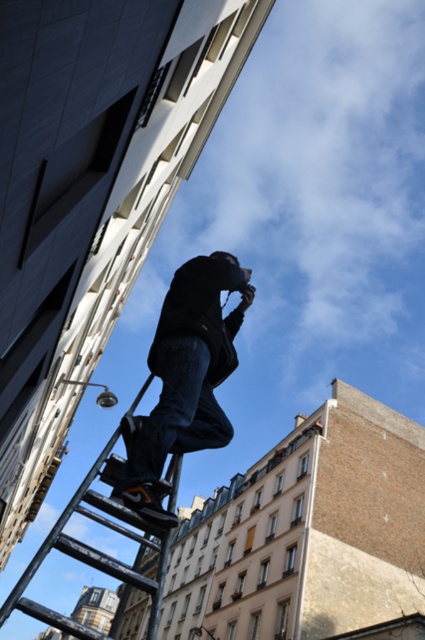
Question: Does denim jeans at center appear on the left side of metallic black ladder at lower center?

Choices:
 (A) yes
 (B) no

Answer: (B)

Question: Can you confirm if denim jeans at center is positioned above metallic black ladder at lower center?

Choices:
 (A) yes
 (B) no

Answer: (A)

Question: Which of the following is the farthest from the observer?

Choices:
 (A) (76, 538)
 (B) (163, 330)

Answer: (A)

Question: Does denim jeans at center appear on the right side of metallic black ladder at lower center?

Choices:
 (A) no
 (B) yes

Answer: (B)

Question: Among these objects, which one is nearest to the camera?

Choices:
 (A) metallic black ladder at lower center
 (B) denim jeans at center

Answer: (A)